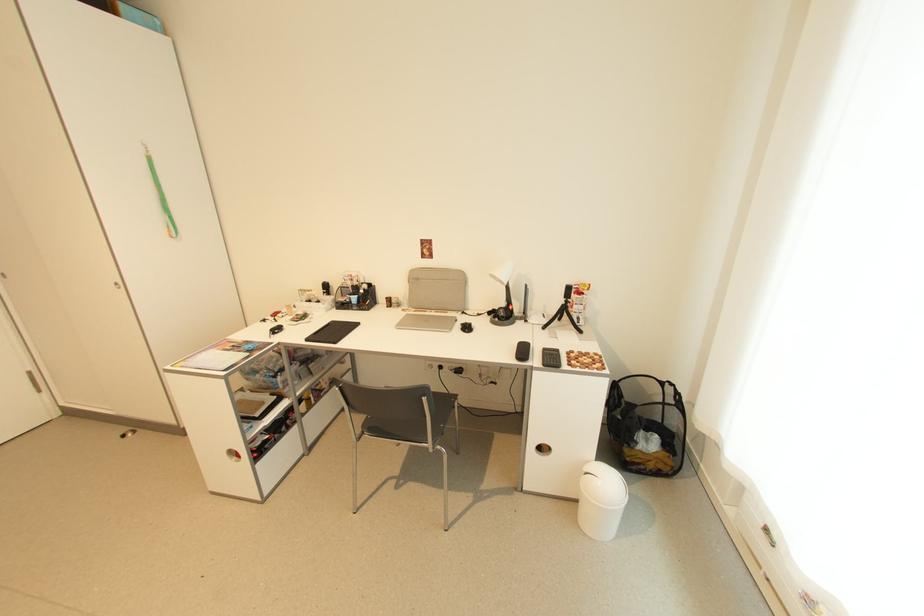
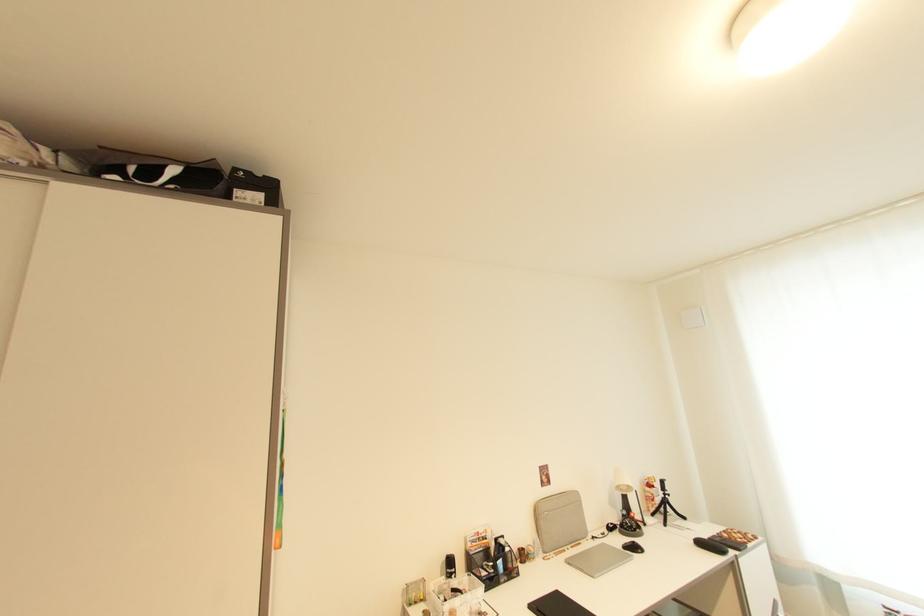
Locate, in the second image, the point that corresponds to point (568, 304) in the first image.

(669, 498)